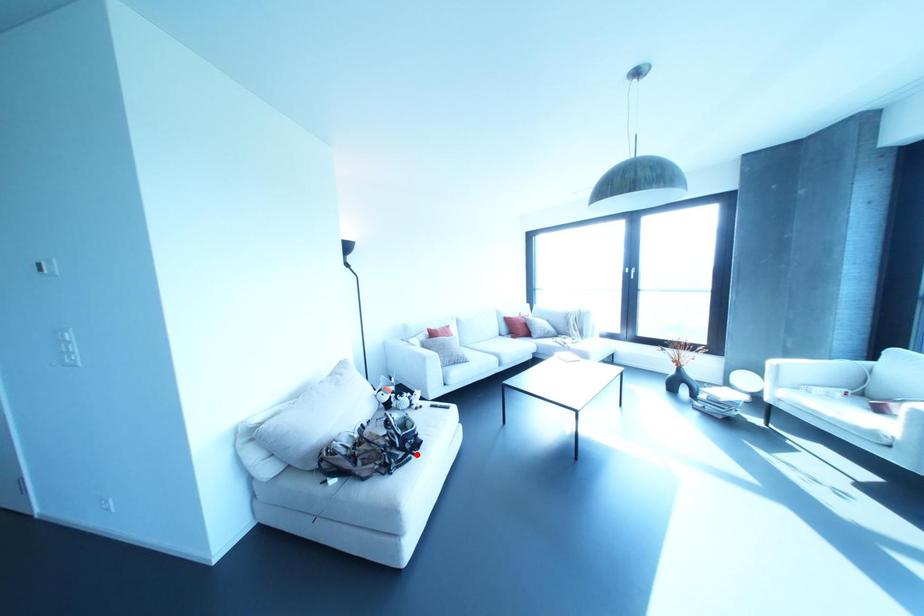
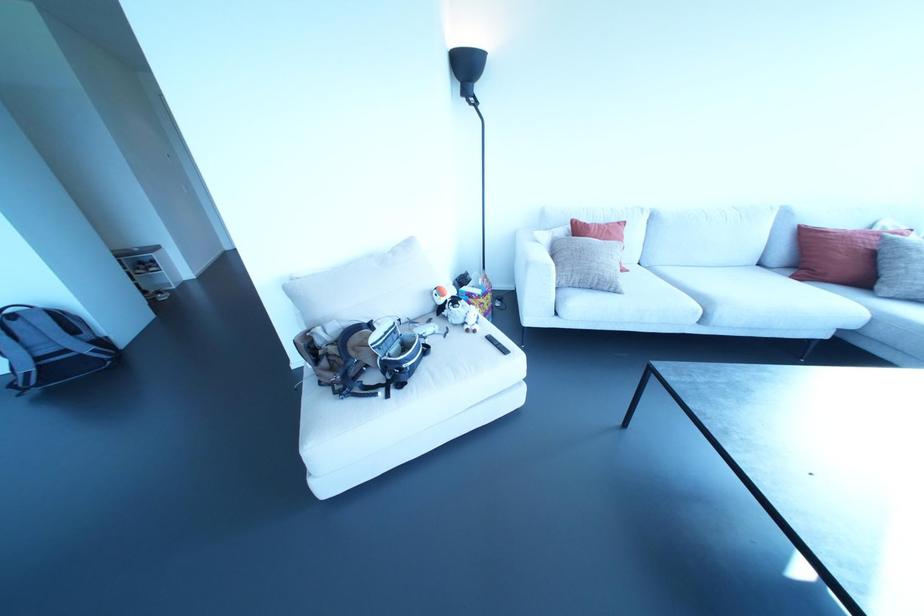
Question: I am providing you with two images of the same scene from different viewpoints. A red point is marked on the first image. Is the red point's position out of view in image 2?

Choices:
 (A) Yes
 (B) No

Answer: (B)